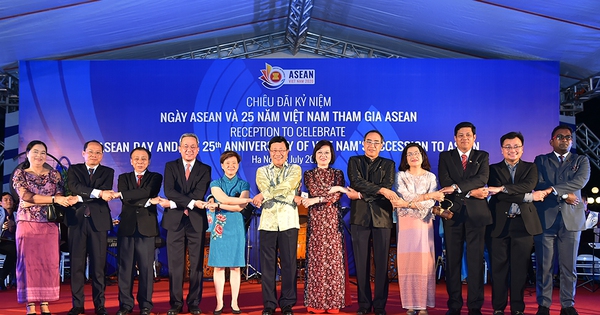
Find the location of a particular element. Image resolution: width=600 pixels, height=315 pixels. red carpet is located at coordinates (593, 305).